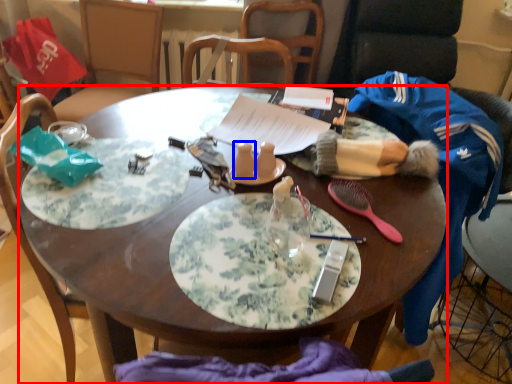
Question: Among these objects, which one is farthest to the camera, desk (highlighted by a red box) or tableware (highlighted by a blue box)?

Choices:
 (A) desk
 (B) tableware

Answer: (B)